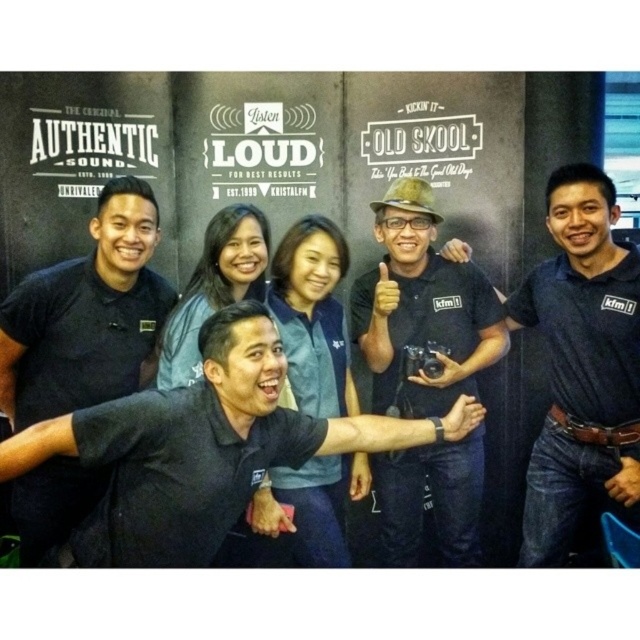
You are standing in front of the photo backdrop and notice two points marked on the image. The first point is at coordinates point (260, 401) and the second is at point (637, 339). Which point is closer to you?

Point (260, 401) is closer to the viewer than point (637, 339).

You are standing at point [61,435] in the scene. You want to take a photo of the camera. Is the camera within a 30 meter range of your current position?

The distance between point [61,435] and the camera is 32.58 meters, which is beyond the 30 meter range. Therefore, the camera is not within range.